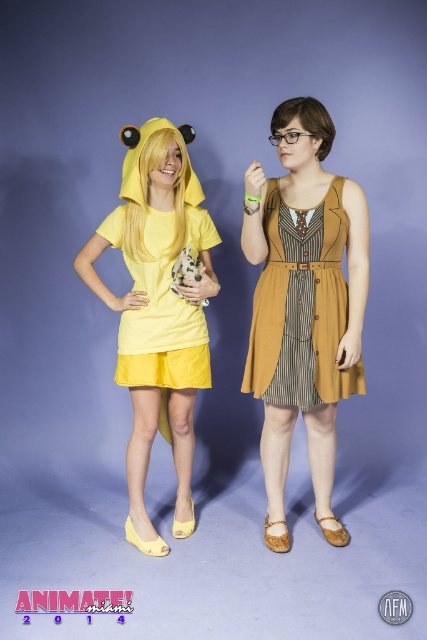
Question: Is matte yellow dress at center bigger than mustard linen dress at center?

Choices:
 (A) yes
 (B) no

Answer: (A)

Question: Is mustard fabric dress at center to the right of mustard linen dress at center from the viewer's perspective?

Choices:
 (A) yes
 (B) no

Answer: (B)

Question: Is mustard fabric dress at center below mustard linen dress at center?

Choices:
 (A) no
 (B) yes

Answer: (B)

Question: Which point appears farthest from the camera in this image?

Choices:
 (A) (353, 195)
 (B) (321, 330)

Answer: (B)

Question: Considering the real-world distances, which object is farthest from the mustard linen dress at center?

Choices:
 (A) mustard fabric dress at center
 (B) matte yellow dress at center

Answer: (B)

Question: Which of the following is the closest to the observer?

Choices:
 (A) mustard fabric dress at center
 (B) matte yellow dress at center

Answer: (A)